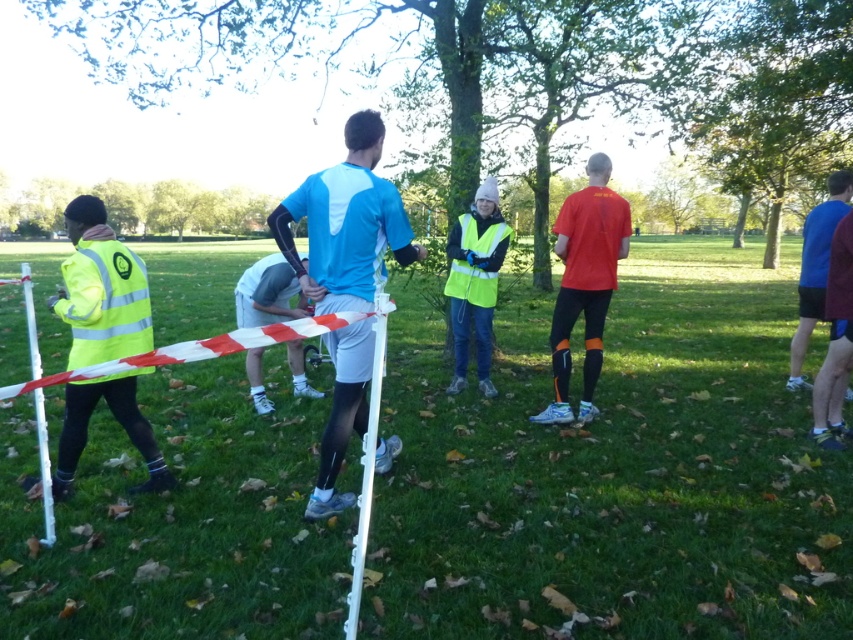
You are a photographer trying to capture a clear shot of the blue matte shirt at center and the light gray fabric shorts at center. If your camera lens can only focus on objects within a 1.2 meter width, will both items fit within the frame?

The blue matte shirt at center might be wider than light gray fabric shorts at center, so it depends on the exact width of the blue matte shirt at center. If it is wider than 1.2 meters, then the blue matte shirt at center might not fit, but if it is narrower, both could fit.

From the picture: You are a photographer setting up for a sports event in the park. You need to position your camera so that the blue fabric shirt at right and the white plastic pole at lower left are both visible in the frame. Based on their positions, which object should be placed closer to the right side of your camera viewfinder?

The blue fabric shirt at right should be placed closer to the right side of your camera viewfinder since it is positioned to the right of the white plastic pole at lower left.